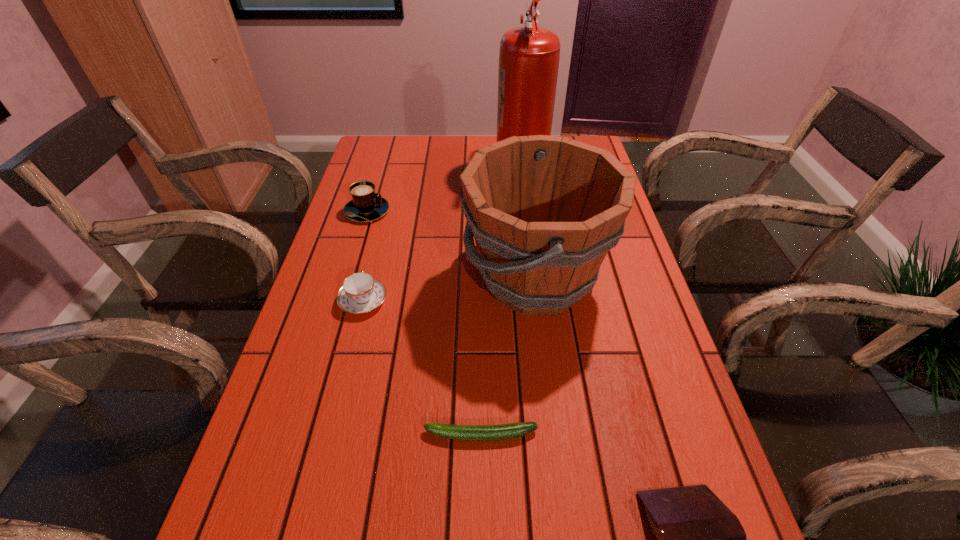
You are a GUI agent. You are given a task and a screenshot of the screen. Output one action in this format:
    pyautogui.click(x=<x>, y=<y>)
    Task: Click on the farthest object
    
    Given the screenshot: What is the action you would take?
    pyautogui.click(x=529, y=56)

Locate an element on the screen. the tallest object is located at coordinates (529, 56).

Find the location of a particular element. This screenshot has height=540, width=960. bucket is located at coordinates (544, 210).

What are the coordinates of `the fourth shortest object` in the screenshot? It's located at (366, 205).

In order to click on cappuccino in this screenshot , I will do `click(366, 205)`.

What are the coordinates of `teacup` in the screenshot? It's located at (360, 293).

Where is `the shortest object`? The width and height of the screenshot is (960, 540). the shortest object is located at coordinates coord(513,430).

This screenshot has width=960, height=540. I want to click on zucchini, so click(513, 430).

The height and width of the screenshot is (540, 960). In order to click on vacant space located on the instruction side of the fire extinguisher in this screenshot , I will do `click(439, 166)`.

The width and height of the screenshot is (960, 540). Identify the location of free spot located on the instruction side of the fire extinguisher. (477, 166).